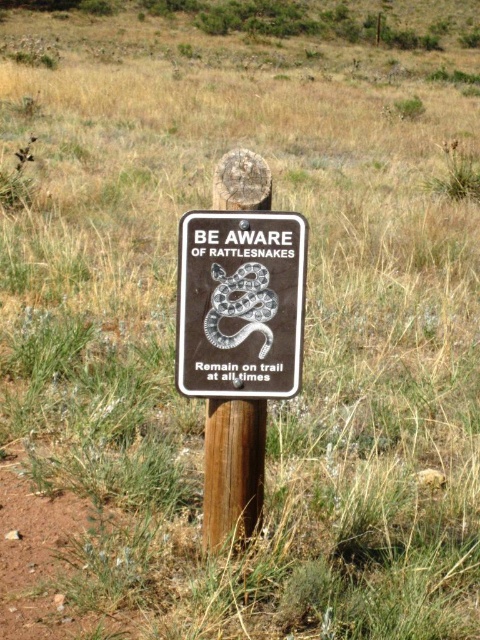
Can you confirm if black matte sign at center is shorter than brown wood post at center?

No.

Between point (208, 272) and point (215, 483), which one is positioned behind?

The point (215, 483) is behind.

This screenshot has width=480, height=640. Find the location of `black matte sign at center`. black matte sign at center is located at coordinates (240, 304).